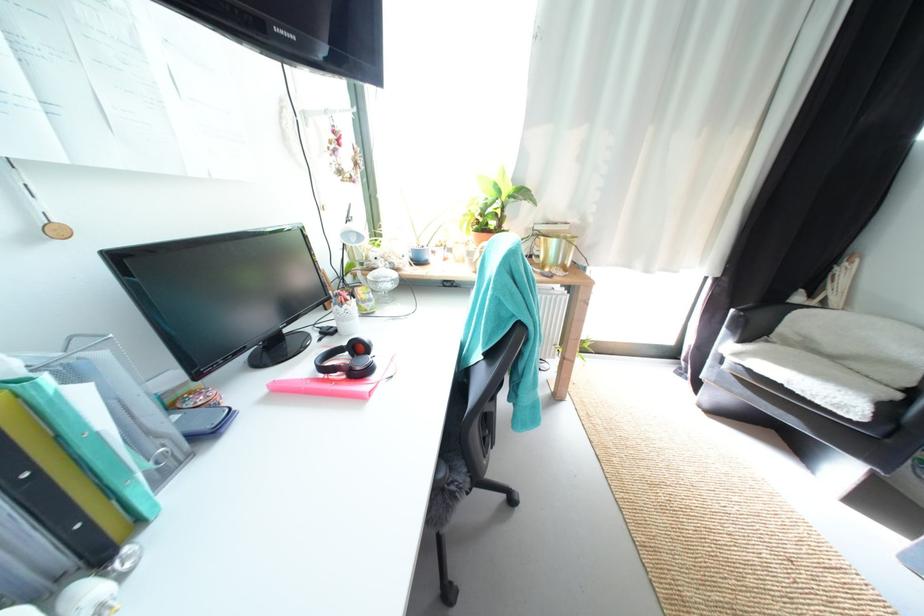
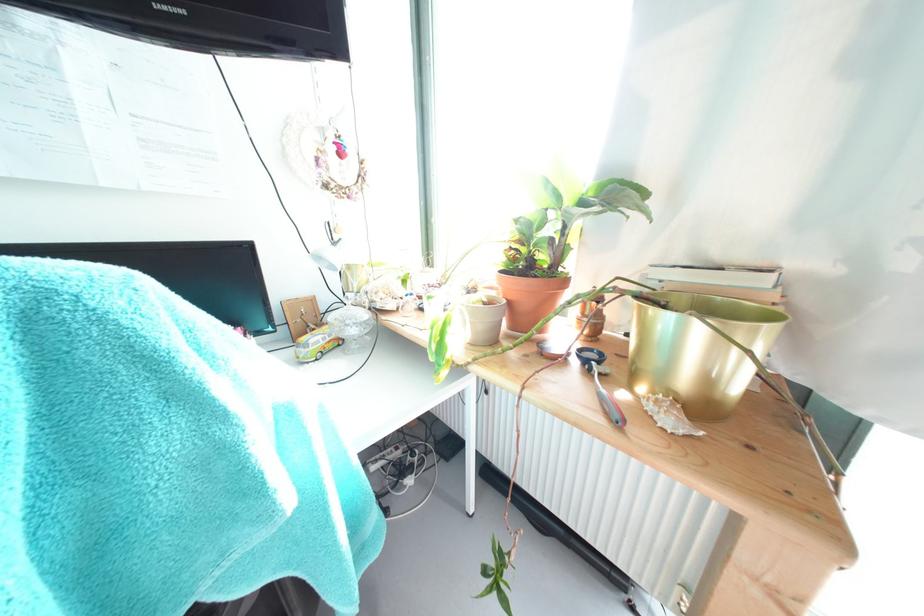
In the second image, find the point that corresponds to [377,310] in the first image.

(309, 358)